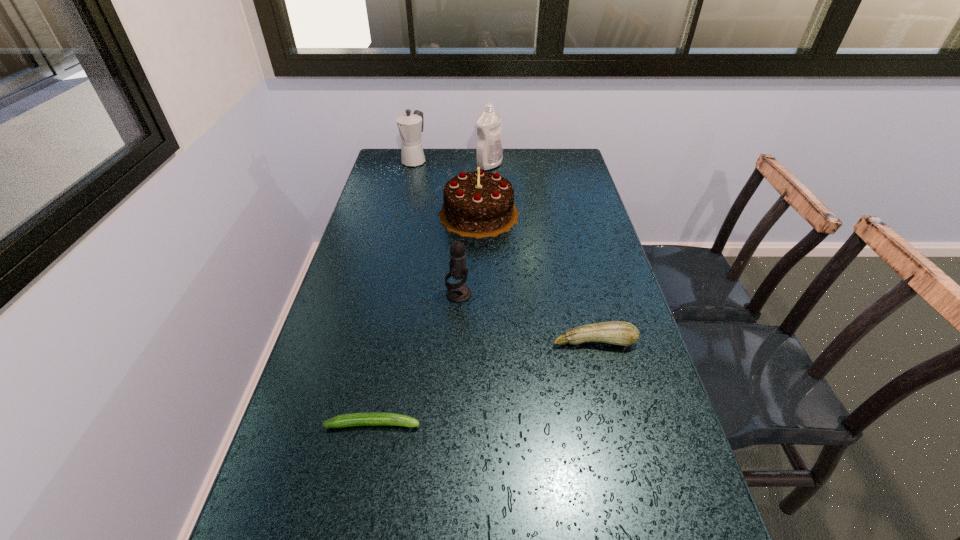
Identify the location of detergent. (489, 153).

Identify the location of coffeepot. This screenshot has height=540, width=960. (410, 126).

You are a GUI agent. You are given a task and a screenshot of the screen. Output one action in this format:
    pyautogui.click(x=<x>, y=<y>)
    Task: Click on the birthday cake
    
    Given the screenshot: What is the action you would take?
    pyautogui.click(x=478, y=204)

The image size is (960, 540). Identify the location of microphone. (458, 292).

At what (x,y) coordinates should I click in order to perform the action: click on the fifth farthest object. Please return your answer as a coordinate pair (x, y). Looking at the image, I should click on (622, 333).

You are a GUI agent. You are given a task and a screenshot of the screen. Output one action in this format:
    pyautogui.click(x=<x>, y=<y>)
    Task: Click on the rightmost object
    The width and height of the screenshot is (960, 540).
    Given the screenshot: What is the action you would take?
    pyautogui.click(x=622, y=333)

Identify the location of the left zucchini. (366, 418).

Locate an element on the screen. This screenshot has height=540, width=960. the shorter zucchini is located at coordinates (366, 418).

Find the location of `free space located on the front of the detergent`. free space located on the front of the detergent is located at coordinates (491, 188).

Locate an element on the screen. This screenshot has width=960, height=540. vacant space located on the front of the coffeepot is located at coordinates (400, 218).